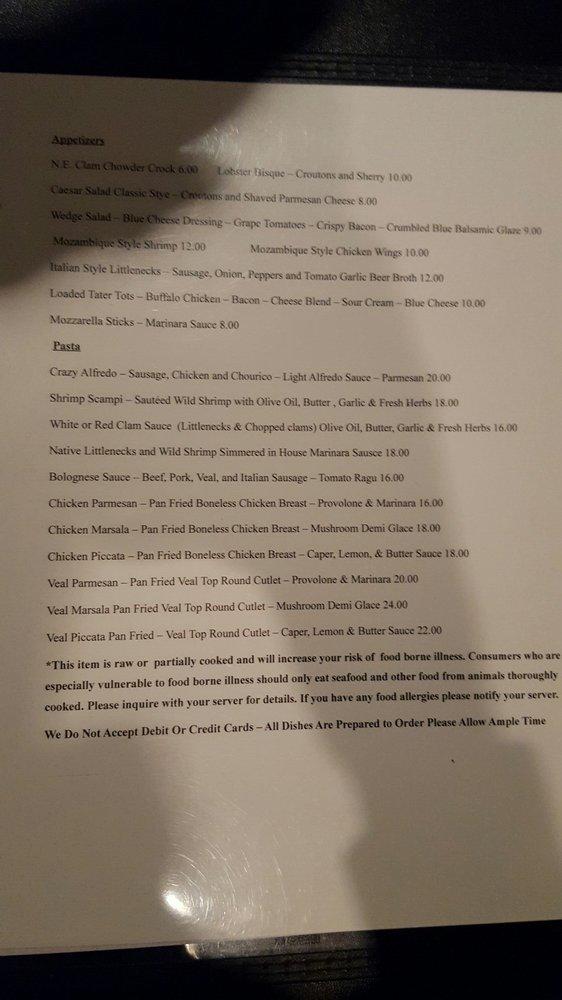
Where is `restaurant menu`? restaurant menu is located at coordinates (238, 445), (238, 853).